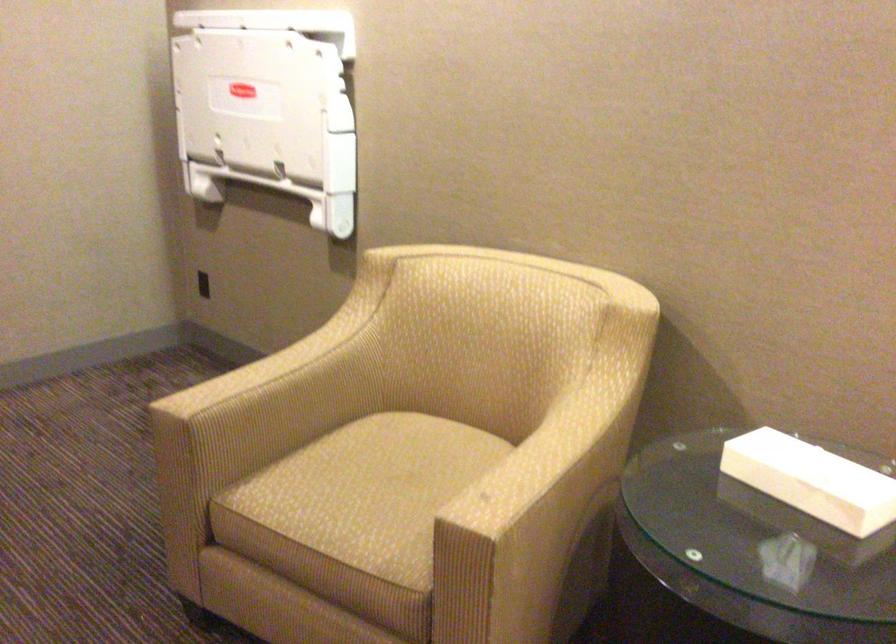
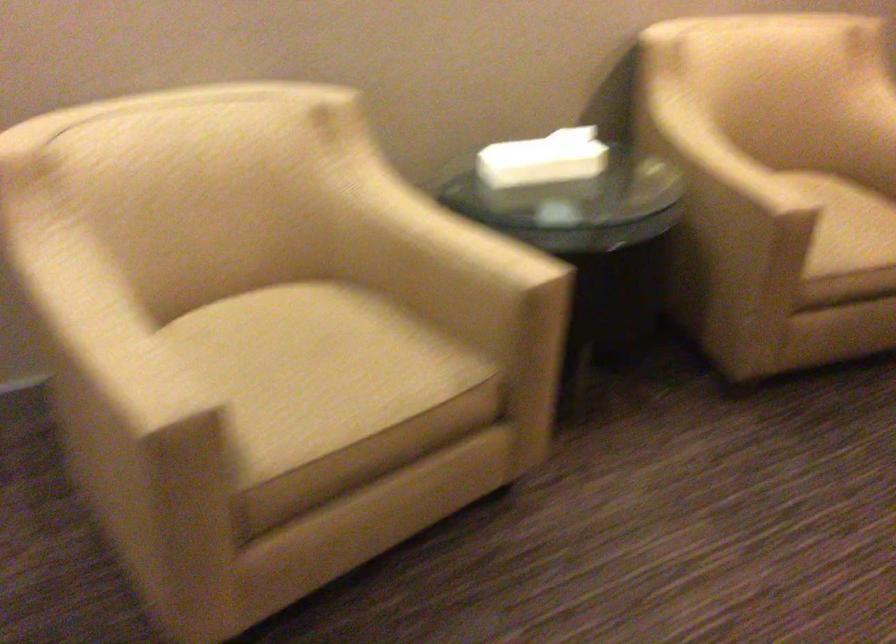
The point at [363,486] is marked in the first image. Where is the corresponding point in the second image?

(316, 370)